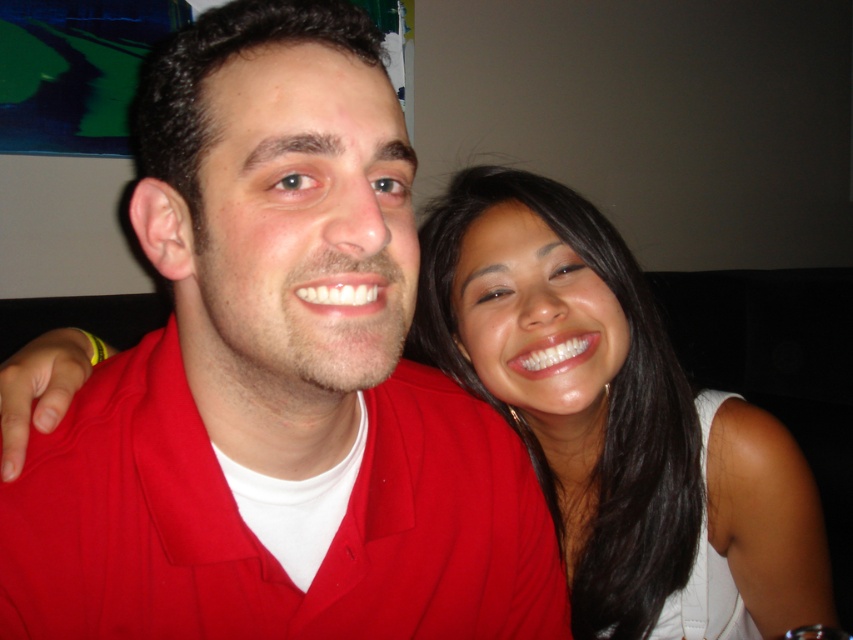
Question: Among these points, which one is nearest to the camera?

Choices:
 (A) (345, 257)
 (B) (497, 410)

Answer: (A)

Question: Is matte red shirt at center behind smooth white tank top at center?

Choices:
 (A) yes
 (B) no

Answer: (B)

Question: Is matte red shirt at center to the right of smooth white tank top at center from the viewer's perspective?

Choices:
 (A) no
 (B) yes

Answer: (A)

Question: Which object appears farthest from the camera in this image?

Choices:
 (A) smooth white tank top at center
 (B) matte red shirt at center

Answer: (A)

Question: Which point is closer to the camera?

Choices:
 (A) (74, 456)
 (B) (514, 372)

Answer: (A)

Question: Does matte red shirt at center have a greater width compared to smooth white tank top at center?

Choices:
 (A) yes
 (B) no

Answer: (B)